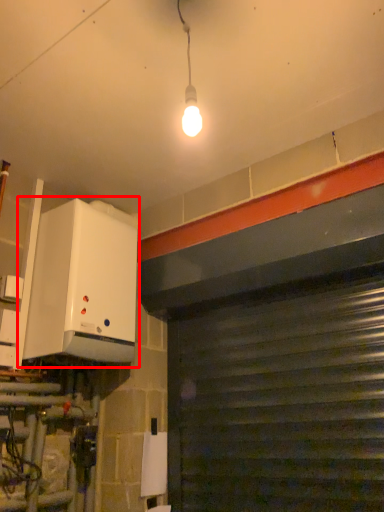
Question: From the image's perspective, what is the correct spatial positioning of appliance (annotated by the red box) in reference to garage door?

Choices:
 (A) below
 (B) above

Answer: (B)